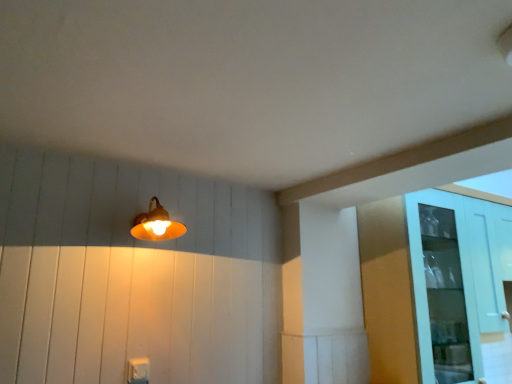
Question: Is matte orange lampshade at upper left further to camera compared to light blue glass cabinet at right?

Choices:
 (A) no
 (B) yes

Answer: (A)

Question: Considering the relative positions of matte orange lampshade at upper left and light blue glass cabinet at right in the image provided, is matte orange lampshade at upper left to the left of light blue glass cabinet at right from the viewer's perspective?

Choices:
 (A) yes
 (B) no

Answer: (A)

Question: Considering the relative positions of matte orange lampshade at upper left and light blue glass cabinet at right in the image provided, is matte orange lampshade at upper left in front of light blue glass cabinet at right?

Choices:
 (A) no
 (B) yes

Answer: (B)

Question: From the image's perspective, is matte orange lampshade at upper left beneath light blue glass cabinet at right?

Choices:
 (A) no
 (B) yes

Answer: (A)

Question: Is light blue glass cabinet at right completely or partially inside matte orange lampshade at upper left?

Choices:
 (A) no
 (B) yes

Answer: (A)

Question: From a real-world perspective, is matte orange lampshade at upper left below light blue glass cabinet at right?

Choices:
 (A) yes
 (B) no

Answer: (B)

Question: From a real-world perspective, is light blue glass cabinet at right below matte orange lampshade at upper left?

Choices:
 (A) no
 (B) yes

Answer: (B)

Question: Could you tell me if light blue glass cabinet at right is turned towards matte orange lampshade at upper left?

Choices:
 (A) no
 (B) yes

Answer: (A)

Question: From the image's perspective, is light blue glass cabinet at right on matte orange lampshade at upper left?

Choices:
 (A) no
 (B) yes

Answer: (A)

Question: Can you confirm if light blue glass cabinet at right is bigger than matte orange lampshade at upper left?

Choices:
 (A) yes
 (B) no

Answer: (A)

Question: Is light blue glass cabinet at right oriented away from matte orange lampshade at upper left?

Choices:
 (A) no
 (B) yes

Answer: (A)

Question: Is light blue glass cabinet at right to the right of matte orange lampshade at upper left from the viewer's perspective?

Choices:
 (A) no
 (B) yes

Answer: (B)

Question: Is light blue glass cabinet at right inside the boundaries of matte orange lampshade at upper left, or outside?

Choices:
 (A) outside
 (B) inside

Answer: (A)